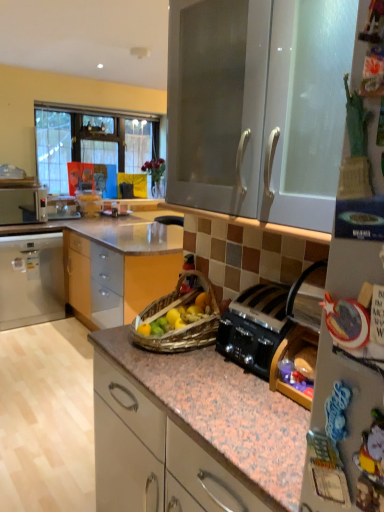
Question: In terms of height, does white glossy cabinet at upper center, the first cabinetry from the front, look taller or shorter compared to white plastic microwave at left?

Choices:
 (A) tall
 (B) short

Answer: (A)

Question: Is white glossy cabinet at upper center, positioned as the 2th cabinetry in back-to-front order, in front of or behind white plastic microwave at left in the image?

Choices:
 (A) behind
 (B) front

Answer: (B)

Question: Based on their relative distances, which object is nearer to the black metallic toaster at center-right?

Choices:
 (A) matte white cabinet at left, the first cabinetry from the left
 (B) white glossy cabinet at upper center, the first cabinetry from the front
 (C) white plastic microwave at left

Answer: (B)

Question: Which object is the farthest from the matte white cabinet at left, the second cabinetry from the front?

Choices:
 (A) black metallic toaster at center-right
 (B) white plastic microwave at left
 (C) white glossy cabinet at upper center, positioned as the 2th cabinetry in back-to-front order

Answer: (A)